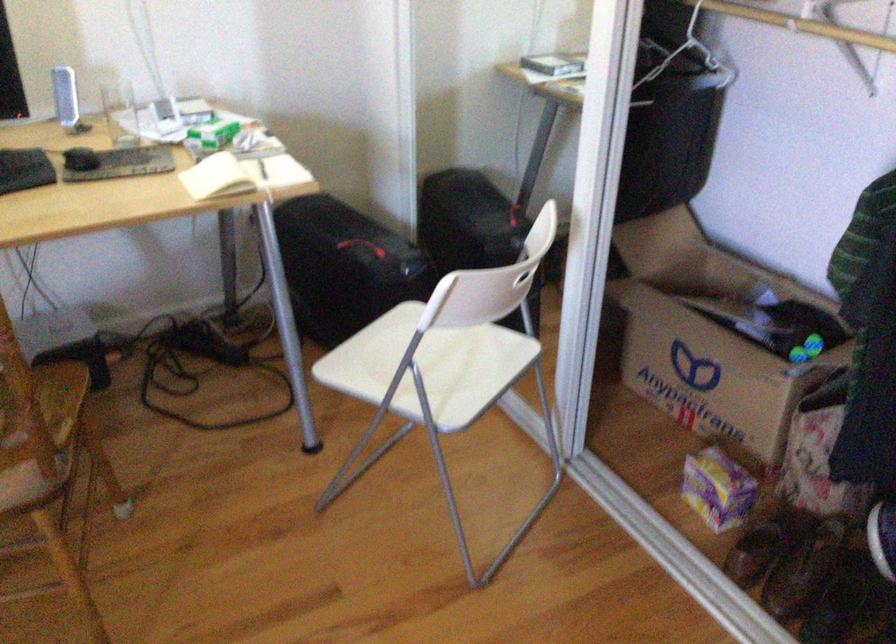
Find the location of a particular element. red bag handle is located at coordinates (362, 247).